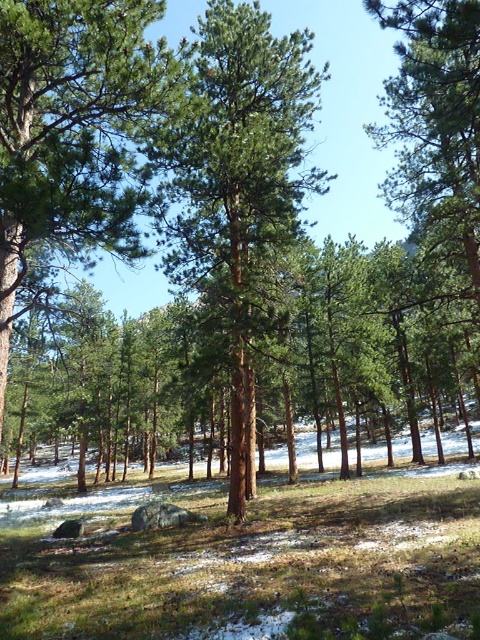
Between point (33, 36) and point (247, 237), which one is positioned behind?

Point (247, 237)

Who is higher up, green rough bark tree at center or green matte tree at center?

green matte tree at center

Is point (121, 259) in front of point (170, 280)?

Yes, it is in front of point (170, 280).

Identify the location of green rough bark tree at center. (72, 138).